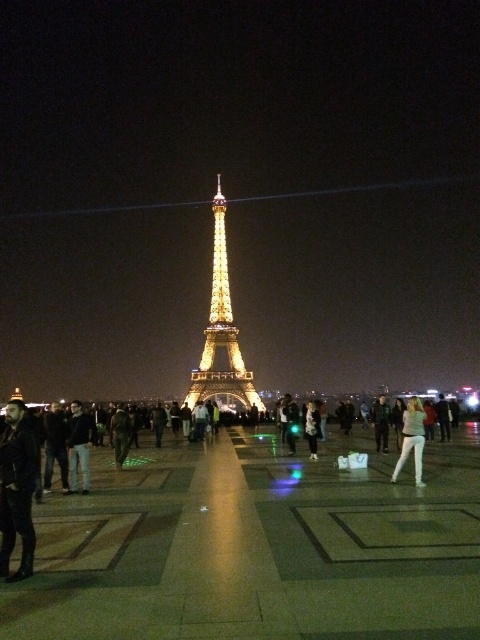
You are standing at the edge of the Trocadero Square in Paris, looking towards the Eiffel Tower. There is a polished stone plaza at center. Can you tell me where the point at coordinates [256,545] is located relative to the plaza?

The point at coordinates [256,545] is located at the polished stone plaza at center, as indicated by the description.

You are a tourist visiting the Eiffel Tower at night. You want to take a photo that includes both the polished stone plaza at center and the gold metallic eiffel tower at center. Which object should you focus on first if you want to ensure both are fully visible in your shot?

The polished stone plaza at center is bigger than the gold metallic eiffel tower at center, so you should focus on the polished stone plaza at center first to ensure both are fully visible in your shot.

You are standing at the Trocadero Square in Paris and want to take a photo of the Eiffel Tower. You notice a specific point marked at coordinates (222,332). What object is located at this point?

The point at coordinates (222,332) corresponds to the gold metallic Eiffel Tower at center.